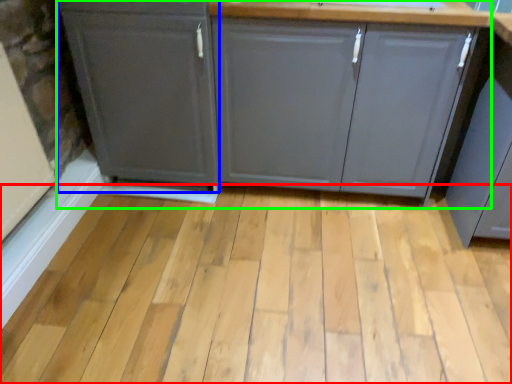
Question: Which is nearer to the plank (highlighted by a red box)? cabinetry (highlighted by a blue box) or cabinetry (highlighted by a green box).

Choices:
 (A) cabinetry
 (B) cabinetry

Answer: (B)